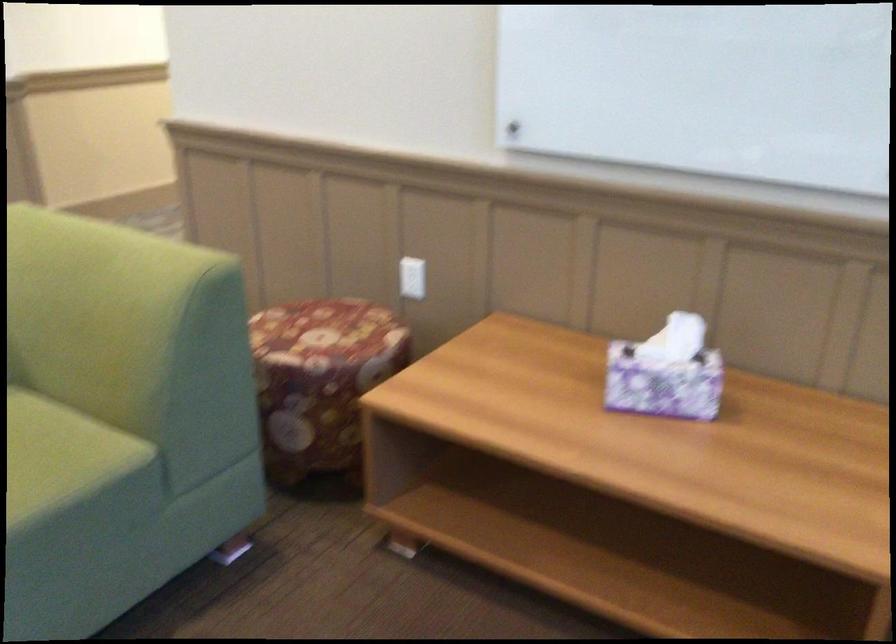
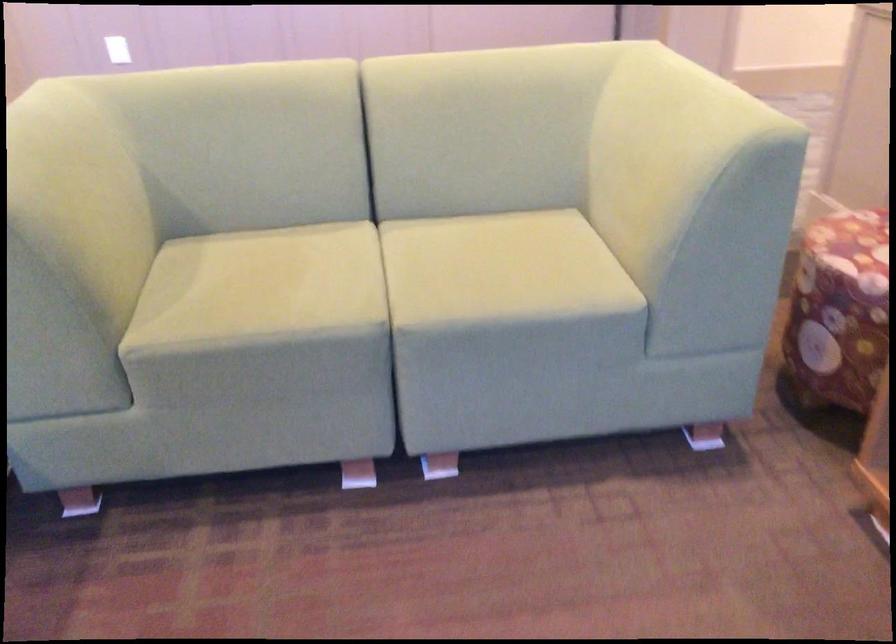
First-person continuous shooting, in which direction is the camera rotating?

The rotation direction of the camera is left-down.